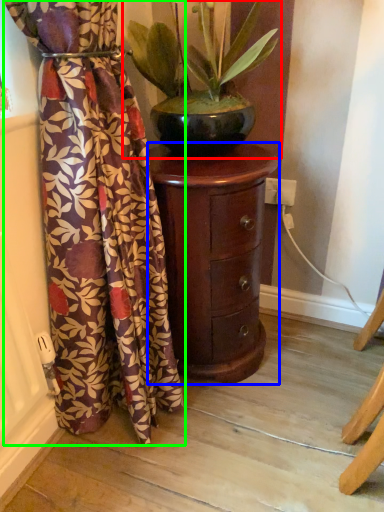
Question: Which object is positioned farthest from houseplant (highlighted by a red box)? Select from furniture (highlighted by a blue box) and curtain (highlighted by a green box).

Choices:
 (A) furniture
 (B) curtain

Answer: (B)